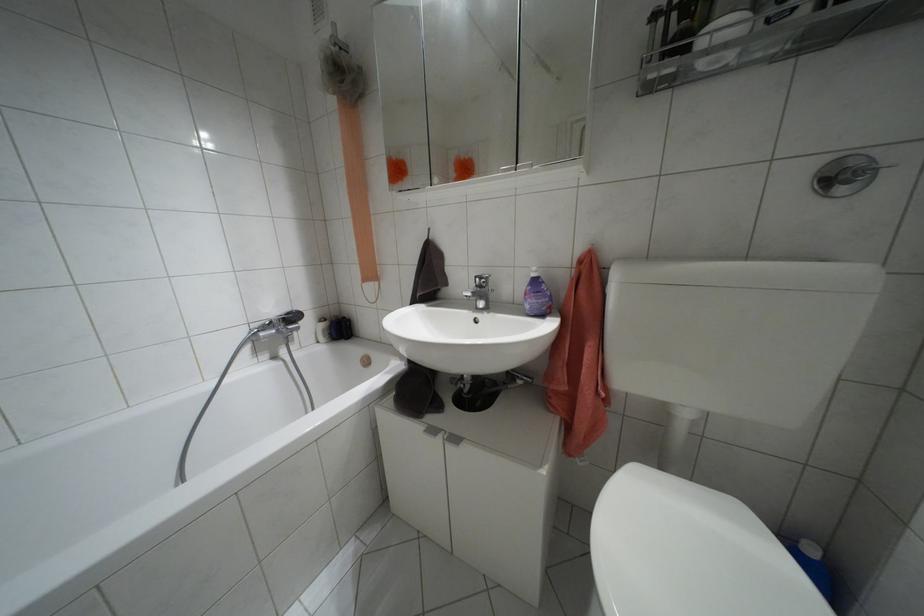
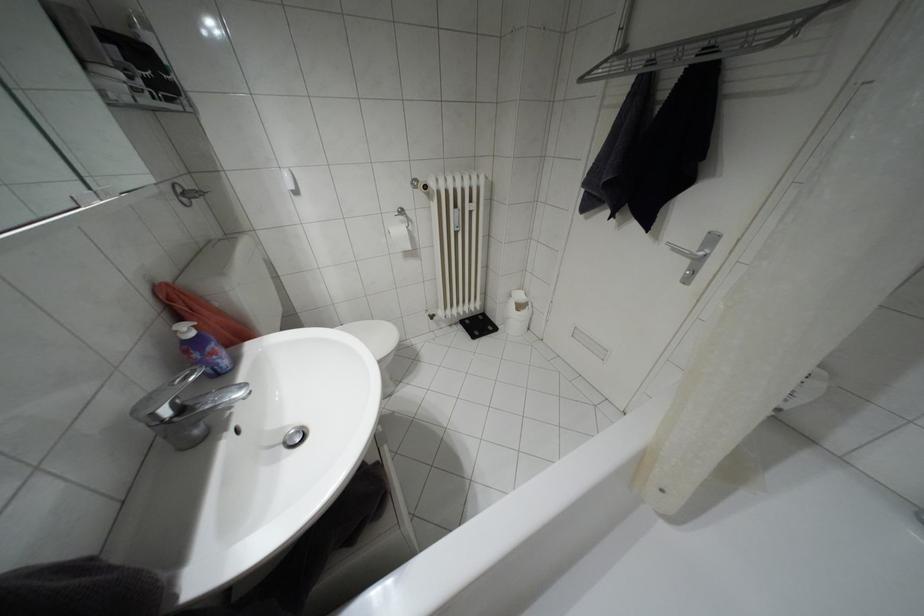
Where in the second image is the point corresponding to the point at 479,286 from the first image?

(180, 408)